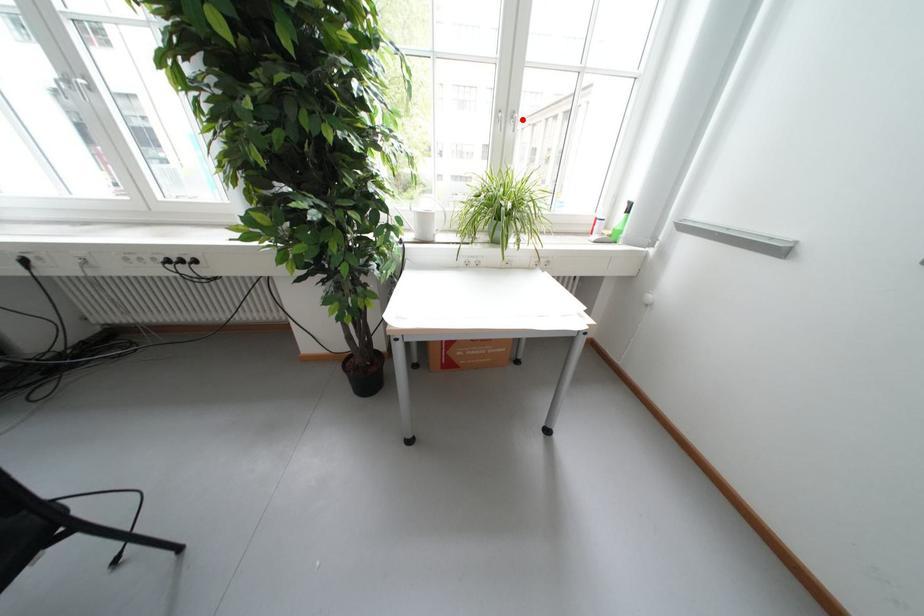
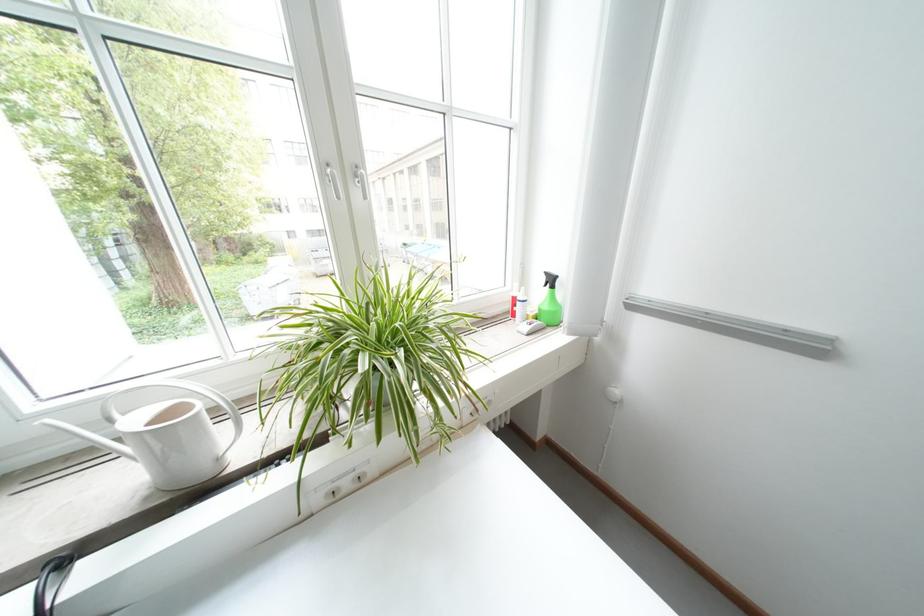
Question: I am providing you with two images of the same scene from different viewpoints. Image1 has a red point marked. In image2, the corresponding 3D location appears at what relative position? Reply with the corresponding letter.

Choices:
 (A) Closer
 (B) Farther

Answer: (B)